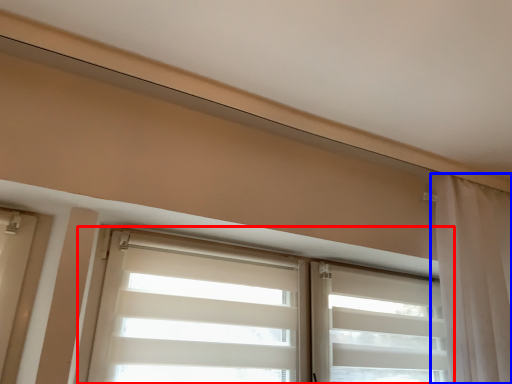
Question: Which of the following is the closest to the observer, window (highlighted by a red box) or curtain (highlighted by a blue box)?

Choices:
 (A) window
 (B) curtain

Answer: (A)